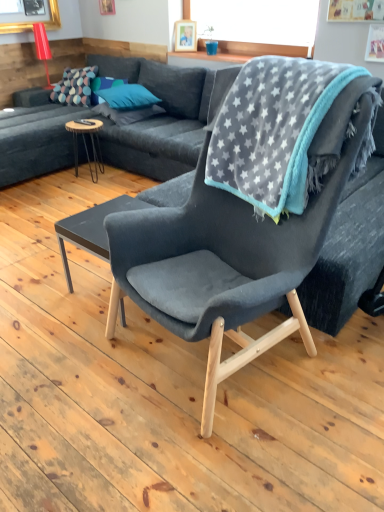
The height and width of the screenshot is (512, 384). Describe the element at coordinates (233, 248) in the screenshot. I see `velvet dark gray chair at center` at that location.

Describe the element at coordinates (127, 97) in the screenshot. The image size is (384, 512). I see `teal fabric pillow at upper left, the 3th pillow from the left` at that location.

I want to click on matte red lampshade at upper left, so click(x=42, y=48).

The image size is (384, 512). I want to click on velvet dark gray chair at center, so click(x=233, y=248).

From the image's perspective, is multicolored dotted fabric pillow at upper left, which ranks as the 1th pillow in left-to-right order, located above or below wooden round table at left, marked as the second coffee table in a right-to-left arrangement?

Based on their image positions, multicolored dotted fabric pillow at upper left, which ranks as the 1th pillow in left-to-right order, is located above wooden round table at left, marked as the second coffee table in a right-to-left arrangement.

Which object is closer to the camera taking this photo, multicolored dotted fabric pillow at upper left, which ranks as the 1th pillow in left-to-right order, or wooden round table at left, which ranks as the 1th coffee table in top-to-bottom order?

Positioned in front is wooden round table at left, which ranks as the 1th coffee table in top-to-bottom order.

In terms of width, does multicolored dotted fabric pillow at upper left, which ranks as the 1th pillow in left-to-right order, look wider or thinner when compared to wooden round table at left, marked as the second coffee table in a right-to-left arrangement?

Considering their sizes, multicolored dotted fabric pillow at upper left, which ranks as the 1th pillow in left-to-right order, looks broader than wooden round table at left, marked as the second coffee table in a right-to-left arrangement.

Measure the distance between multicolored dotted fabric pillow at upper left, which ranks as the 1th pillow in left-to-right order, and wooden round table at left, acting as the second coffee table starting from the bottom.

multicolored dotted fabric pillow at upper left, which ranks as the 1th pillow in left-to-right order, is 29.64 inches from wooden round table at left, acting as the second coffee table starting from the bottom.

Which object is further away from the camera taking this photo, matte red lampshade at upper left or teal fabric pillow at upper left, which is counted as the first pillow, starting from the right?

matte red lampshade at upper left.

What's the angular difference between matte red lampshade at upper left and teal fabric pillow at upper left, which is counted as the first pillow, starting from the right,'s facing directions?

The angle between the facing direction of matte red lampshade at upper left and the facing direction of teal fabric pillow at upper left, which is counted as the first pillow, starting from the right, is 23.5 degrees.

Considering the relative sizes of matte red lampshade at upper left and teal fabric pillow at upper left, which is counted as the first pillow, starting from the right, in the image provided, is matte red lampshade at upper left shorter than teal fabric pillow at upper left, which is counted as the first pillow, starting from the right,?

No.

Is point (46, 59) in front of point (146, 95)?

That is False.

From a real-world perspective, is wooden round table at left, marked as the second coffee table in a right-to-left arrangement, over dark gray matte coffee table at center, the 1th coffee table positioned from the right?

Yes, from a real-world perspective, wooden round table at left, marked as the second coffee table in a right-to-left arrangement, is on top of dark gray matte coffee table at center, the 1th coffee table positioned from the right.

Is wooden round table at left, acting as the second coffee table starting from the bottom, with dark gray matte coffee table at center, which ranks as the 2th coffee table in back-to-front order?

No, wooden round table at left, acting as the second coffee table starting from the bottom, is not next to dark gray matte coffee table at center, which ranks as the 2th coffee table in back-to-front order.

Choose the correct answer: Is wooden round table at left, which is counted as the 1th coffee table, starting from the left, inside dark gray matte coffee table at center, which ranks as the 2th coffee table in back-to-front order, or outside it?

→ wooden round table at left, which is counted as the 1th coffee table, starting from the left, is not enclosed by dark gray matte coffee table at center, which ranks as the 2th coffee table in back-to-front order.

Can you confirm if wooden round table at left, the 1th coffee table from the back, is wider than dark gray matte coffee table at center, which ranks as the 2th coffee table in back-to-front order?

In fact, wooden round table at left, the 1th coffee table from the back, might be narrower than dark gray matte coffee table at center, which ranks as the 2th coffee table in back-to-front order.

Considering the sizes of objects wooden picture frame at upper center and dark gray matte coffee table at center, acting as the 1th coffee table starting from the bottom, in the image provided, who is shorter, wooden picture frame at upper center or dark gray matte coffee table at center, acting as the 1th coffee table starting from the bottom,?

wooden picture frame at upper center is shorter.

Based on the photo, can you confirm if wooden picture frame at upper center is wider than dark gray matte coffee table at center, which ranks as the 2th coffee table in back-to-front order?

In fact, wooden picture frame at upper center might be narrower than dark gray matte coffee table at center, which ranks as the 2th coffee table in back-to-front order.

Is wooden picture frame at upper center inside the boundaries of dark gray matte coffee table at center, the 1th coffee table when ordered from front to back, or outside?

wooden picture frame at upper center cannot be found inside dark gray matte coffee table at center, the 1th coffee table when ordered from front to back.

Considering the relative positions of wooden picture frame at upper center and dark gray matte coffee table at center, the 1th coffee table positioned from the right, in the image provided, is wooden picture frame at upper center to the right of dark gray matte coffee table at center, the 1th coffee table positioned from the right, from the viewer's perspective?

Correct, you'll find wooden picture frame at upper center to the right of dark gray matte coffee table at center, the 1th coffee table positioned from the right.

From a real-world perspective, which is physically below, gray star-patterned blanket at upper right or dark gray matte coffee table at center, which is the 2th coffee table from top to bottom?

dark gray matte coffee table at center, which is the 2th coffee table from top to bottom.

Based on their positions, is gray star-patterned blanket at upper right located to the left or right of dark gray matte coffee table at center, the 1th coffee table when ordered from front to back?

From the image, it's evident that gray star-patterned blanket at upper right is to the right of dark gray matte coffee table at center, the 1th coffee table when ordered from front to back.

Looking at the image, does gray star-patterned blanket at upper right seem bigger or smaller compared to dark gray matte coffee table at center, the 1th coffee table positioned from the right?

Considering their sizes, gray star-patterned blanket at upper right takes up more space than dark gray matte coffee table at center, the 1th coffee table positioned from the right.

Consider the image. Considering the relative positions of wooden picture frame at upper center and multicolored dotted fabric pillow at upper left, which ranks as the 1th pillow in left-to-right order, in the image provided, is wooden picture frame at upper center behind multicolored dotted fabric pillow at upper left, which ranks as the 1th pillow in left-to-right order,?

No, it is in front of multicolored dotted fabric pillow at upper left, which ranks as the 1th pillow in left-to-right order.

Considering the sizes of wooden picture frame at upper center and multicolored dotted fabric pillow at upper left, which is counted as the 3th pillow, starting from the right, in the image, is wooden picture frame at upper center wider or thinner than multicolored dotted fabric pillow at upper left, which is counted as the 3th pillow, starting from the right,?

wooden picture frame at upper center is thinner than multicolored dotted fabric pillow at upper left, which is counted as the 3th pillow, starting from the right.

From a real-world perspective, does wooden picture frame at upper center sit lower than multicolored dotted fabric pillow at upper left, which is counted as the 3th pillow, starting from the right?

No, from a real-world perspective, wooden picture frame at upper center is not under multicolored dotted fabric pillow at upper left, which is counted as the 3th pillow, starting from the right.

Based on the photo, from a real-world perspective, which object stands above the other?

dark gray fabric couch at upper left, from a real-world perspective.

Could you tell me if wooden round table at left, which ranks as the second coffee table in front-to-back order, is turned towards dark gray fabric couch at upper left?

No, wooden round table at left, which ranks as the second coffee table in front-to-back order, is not facing towards dark gray fabric couch at upper left.

How different are the orientations of wooden round table at left, acting as the second coffee table starting from the bottom, and dark gray fabric couch at upper left in degrees?

96.6 degrees separate the facing orientations of wooden round table at left, acting as the second coffee table starting from the bottom, and dark gray fabric couch at upper left.

From the image's perspective, would you say wooden round table at left, the 1th coffee table from the back, is shown under dark gray fabric couch at upper left?

Yes, from the image's perspective, wooden round table at left, the 1th coffee table from the back, is below dark gray fabric couch at upper left.

From the image's perspective, which pillow is the 3rd one above the wooden round table at left, marked as the second coffee table in a right-to-left arrangement? Please provide its 2D coordinates.

[(74, 87)]

From the matte red lampshade at upper left, count 3rd pillows forward and point to it. Please provide its 2D coordinates.

[(127, 97)]

Based on their spatial positions, is multicolored dotted fabric pillow at upper left, which ranks as the 1th pillow in left-to-right order, or matte red lampshade at upper left closer to gray star-patterned blanket at upper right?

The object closer to gray star-patterned blanket at upper right is multicolored dotted fabric pillow at upper left, which ranks as the 1th pillow in left-to-right order.

Based on their spatial positions, is gray star-patterned blanket at upper right or wooden picture frame at upper center further from velvet dark gray chair at center?

wooden picture frame at upper center is further to velvet dark gray chair at center.

Based on their spatial positions, is velvet dark gray chair at center or gray star-patterned blanket at upper right further from dark gray fabric couch at upper left?

velvet dark gray chair at center lies further to dark gray fabric couch at upper left than the other object.

Considering their positions, is dark gray matte coffee table at center, the 1th coffee table when ordered from front to back, positioned closer to teal fabric pillow at center, the 2th pillow from the left, than teal fabric pillow at upper left, which is counted as the first pillow, starting from the right?

Among the two, teal fabric pillow at upper left, which is counted as the first pillow, starting from the right, is located nearer to teal fabric pillow at center, the 2th pillow from the left.

Looking at the image, which one is located further to teal fabric pillow at upper left, the 3th pillow from the left, dark gray fabric couch at upper left or wooden picture frame at upper center?

wooden picture frame at upper center is further to teal fabric pillow at upper left, the 3th pillow from the left.

Which object lies further to the anchor point teal fabric pillow at upper left, the 3th pillow from the left, teal fabric pillow at center, the 2th pillow from the left, or matte red lampshade at upper left?

Among the two, matte red lampshade at upper left is located further to teal fabric pillow at upper left, the 3th pillow from the left.

When comparing their distances from multicolored dotted fabric pillow at upper left, which ranks as the 1th pillow in left-to-right order, does matte red lampshade at upper left or dark gray matte coffee table at center, which is the 2th coffee table from top to bottom, seem further?

dark gray matte coffee table at center, which is the 2th coffee table from top to bottom, is positioned further to the anchor multicolored dotted fabric pillow at upper left, which ranks as the 1th pillow in left-to-right order.

Considering their positions, is velvet dark gray chair at center positioned further to teal fabric pillow at upper left, which is counted as the first pillow, starting from the right, than matte red lampshade at upper left?

Based on the image, velvet dark gray chair at center appears to be further to teal fabric pillow at upper left, which is counted as the first pillow, starting from the right.

Locate an element on the screen. studio couch located between matte red lampshade at upper left and wooden picture frame at upper center in the left-right direction is located at coordinates (115, 127).

This screenshot has height=512, width=384. In order to click on coffee table positioned between dark gray fabric couch at upper left and teal fabric pillow at center, the 2th pillow from the left, from near to far in this screenshot , I will do coord(85,142).

What are the coordinates of `blanket positioned between velvet dark gray chair at center and multicolored dotted fabric pillow at upper left, which is counted as the 3th pillow, starting from the right, from near to far` in the screenshot? It's located at (276, 132).

Identify the location of coffee table between dark gray matte coffee table at center, acting as the 1th coffee table starting from the bottom, and wooden picture frame at upper center, along the z-axis. This screenshot has height=512, width=384. (85, 142).